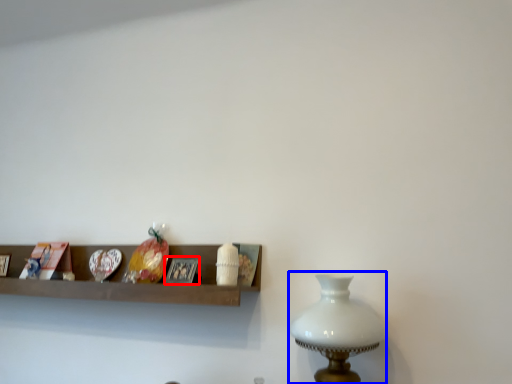
Question: Among these objects, which one is farthest to the camera, picture frame (highlighted by a red box) or table lamp (highlighted by a blue box)?

Choices:
 (A) picture frame
 (B) table lamp

Answer: (A)